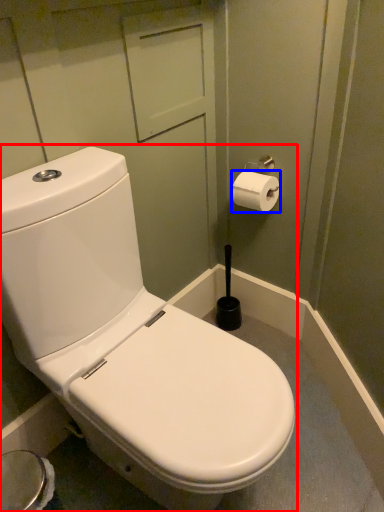
Question: Among these objects, which one is nearest to the camera, toilet (highlighted by a red box) or toilet paper (highlighted by a blue box)?

Choices:
 (A) toilet
 (B) toilet paper

Answer: (A)